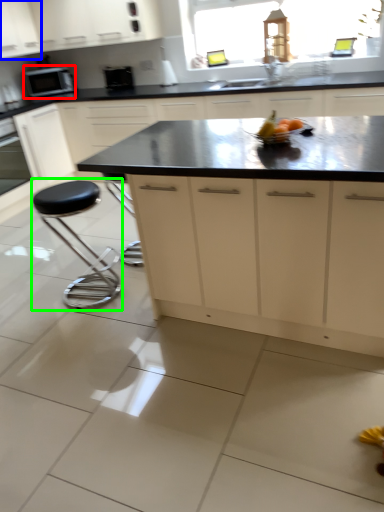
Question: Which is farther away from home appliance (highlighted by a red box)? cabinetry (highlighted by a blue box) or stool (highlighted by a green box)?

Choices:
 (A) cabinetry
 (B) stool

Answer: (B)